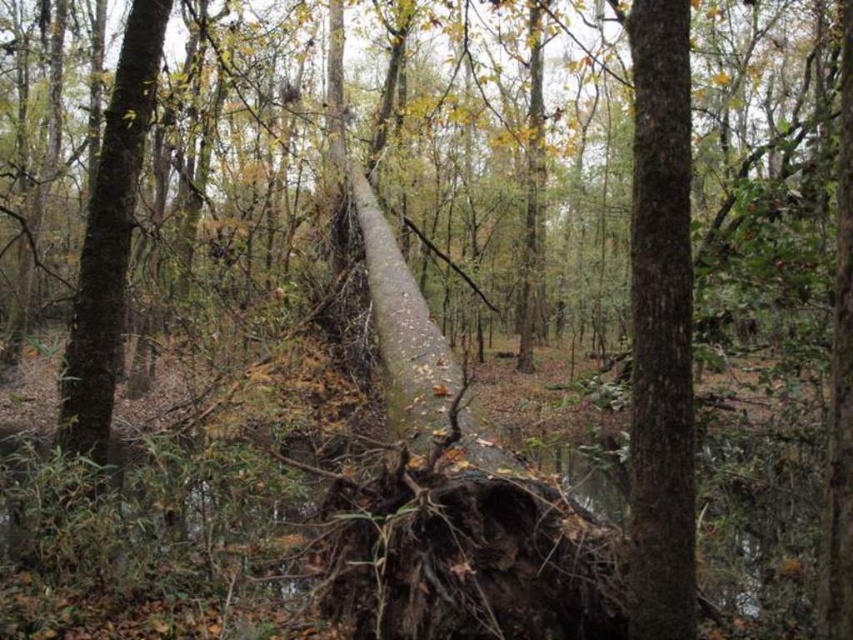
You are a hiker trying to determine which tree trunk is shorter. You see the smooth brown tree trunk at center and the brown rough tree trunk at center. Which one is shorter?

The smooth brown tree trunk at center is shorter than the brown rough tree trunk at center.

You are standing in the forest and want to locate the smooth brown tree trunk at center. According to the coordinates provided, where would you find it?

The smooth brown tree trunk at center is located at the 2D coordinates of point (660,326).

From the picture: You are a hiker trying to cross the forest floor. You see a smooth brown tree trunk at center and a brown rough tree trunk at center. Which one is wider and would provide a more stable surface to step on?

The brown rough tree trunk at center is wider than the smooth brown tree trunk at center, so it would provide a more stable surface to step on.